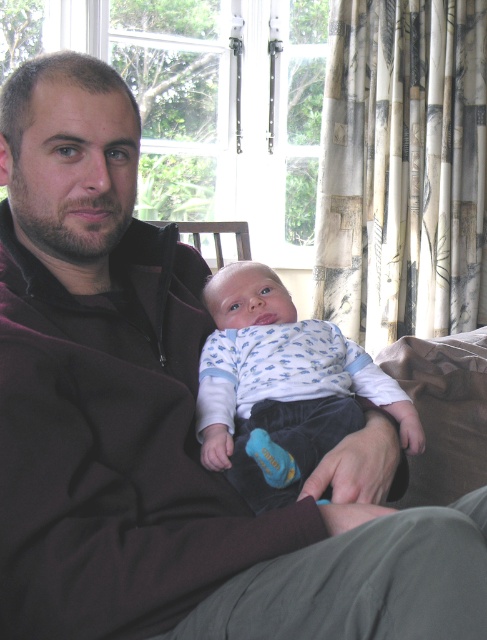
Does white cotton onesie at center have a smaller size compared to wooden armchair at center?

No.

Does white cotton onesie at center have a larger size compared to wooden armchair at center?

Correct, white cotton onesie at center is larger in size than wooden armchair at center.

The width and height of the screenshot is (487, 640). Describe the element at coordinates (280, 387) in the screenshot. I see `white cotton onesie at center` at that location.

You are a GUI agent. You are given a task and a screenshot of the screen. Output one action in this format:
    pyautogui.click(x=<x>, y=<y>)
    Task: Click on the white cotton onesie at center
    
    Given the screenshot: What is the action you would take?
    pyautogui.click(x=280, y=387)